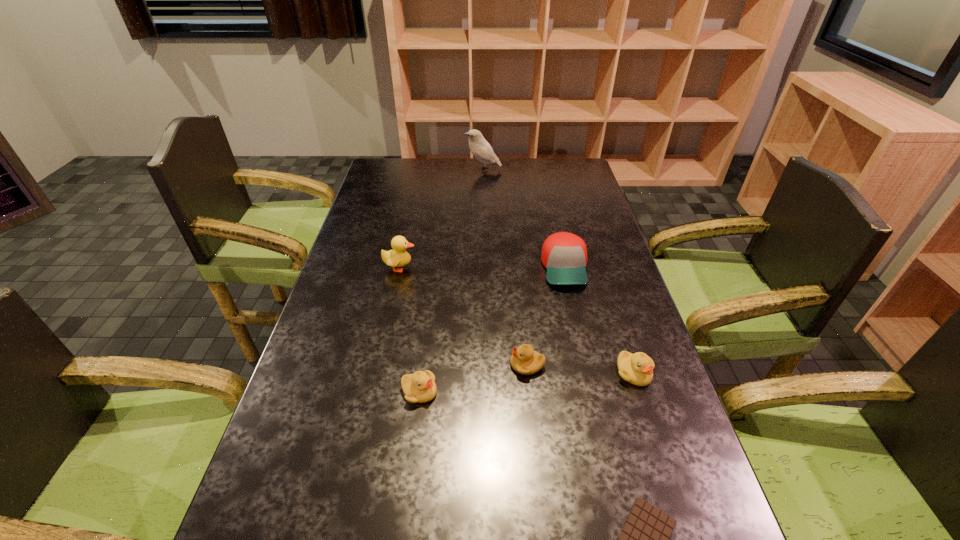
Locate an element on the screen. The width and height of the screenshot is (960, 540). baseball cap located at the right edge is located at coordinates (564, 255).

This screenshot has height=540, width=960. I want to click on duckling positioned at the right edge, so click(637, 368).

In the image, there is a desktop. At what (x,y) coordinates should I click in order to perform the action: click on vacant space at the far edge. Please return your answer as a coordinate pair (x, y). This screenshot has height=540, width=960. Looking at the image, I should click on tap(474, 166).

Locate an element on the screen. vacant space at the left edge of the desktop is located at coordinates (354, 249).

Where is `free space at the right edge`? This screenshot has height=540, width=960. free space at the right edge is located at coordinates point(629,462).

This screenshot has width=960, height=540. Identify the location of vacant space at the far left corner of the desktop. (395, 184).

Image resolution: width=960 pixels, height=540 pixels. Identify the location of free point between the second duckling from right to left and the sixth object from right to left. (473, 379).

This screenshot has height=540, width=960. I want to click on unoccupied area between the third tallest object and the bird, so click(x=524, y=219).

This screenshot has width=960, height=540. Find the location of `empty space between the third tallest object and the rightmost duckling`. empty space between the third tallest object and the rightmost duckling is located at coordinates (599, 320).

Identify the location of free spot between the third duckling from left to right and the second duckling from left to right. Image resolution: width=960 pixels, height=540 pixels. (473, 379).